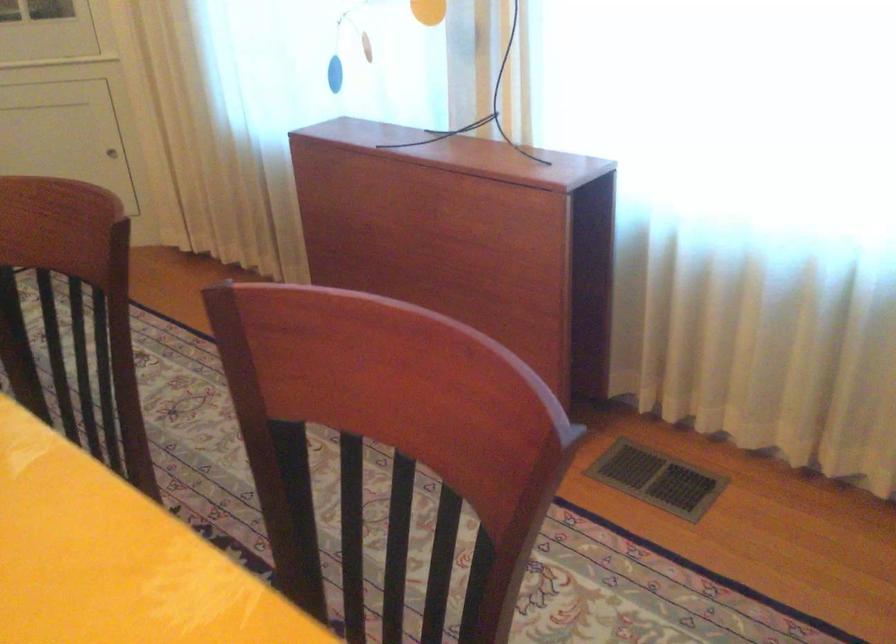
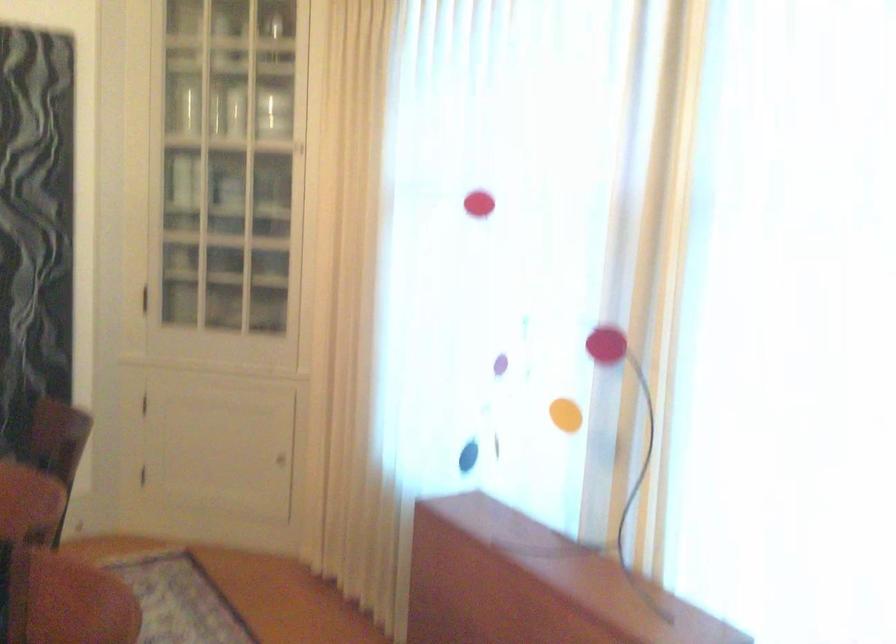
In the scene shown: The images are taken continuously from a first-person perspective. In which direction is your viewpoint rotating?

The camera rotated toward left-up.